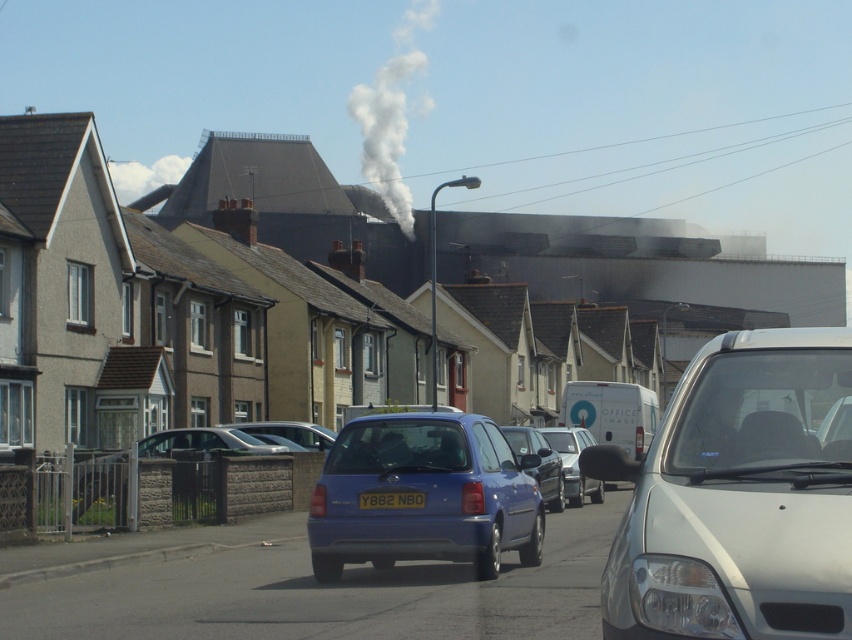
Which is more to the right, white smoke at center or silver metallic van at center?

From the viewer's perspective, silver metallic van at center appears more on the right side.

Is point (383, 116) behind point (573, 461)?

That is True.

Does point (407, 202) lie behind point (568, 483)?

Yes, it is behind point (568, 483).

Locate an element on the screen. white smoke at center is located at coordinates (390, 113).

Measure the distance between matte blue hatchback at center and white smoke at center.

matte blue hatchback at center is 222.24 meters away from white smoke at center.

Can you confirm if matte blue hatchback at center is positioned below white smoke at center?

Correct, matte blue hatchback at center is located below white smoke at center.

Find the location of a particular element. matte blue hatchback at center is located at coordinates (424, 496).

Does silver metallic van at right have a greater width compared to silver metallic van at center?

Correct, the width of silver metallic van at right exceeds that of silver metallic van at center.

Is point (758, 412) farther from viewer compared to point (568, 481)?

No, (758, 412) is closer to viewer.

The height and width of the screenshot is (640, 852). Identify the location of silver metallic van at right. (740, 497).